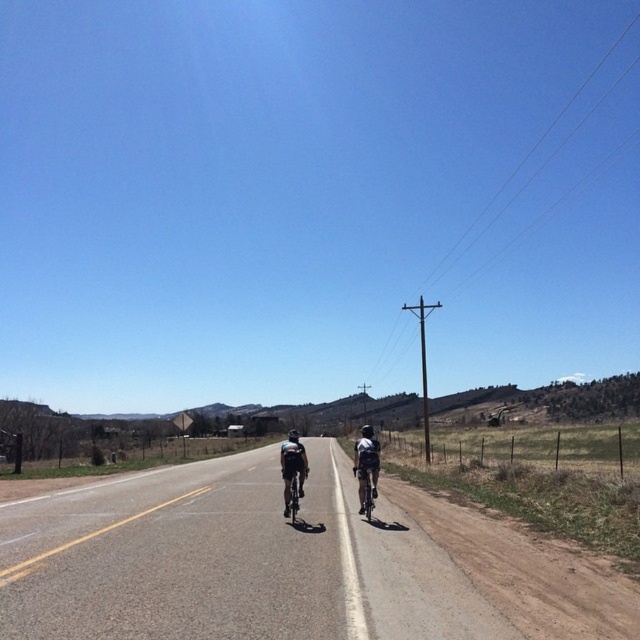
You are a delivery drone planning to fly over the rural road scene. The drone requires a minimum of 2 meters of clearance to safely pass between the asphalt road at center and the shiny metallic bicycle at center. Can you determine if there is enough space for the drone to pass safely?

The asphalt road at center might be wider than shiny metallic bicycle at center, but the exact width difference isn not specified. Without knowing the actual width of the road and the bicycle, it is impossible to determine if there is enough space for the drone to pass safely with 2 meters of clearance.

You are a cyclist planning to ride along the asphalt road at center. You have a shiny silver bicycle at center. Which object will occupy more space in your view as you ride forward?

The asphalt road at center will occupy more space in your view as you ride forward because it is larger in size than the shiny silver bicycle at center.

You are a photographer positioned at the camera location. You want to take a photo of two points on the road. The first point is at point (340,609) and the second point is at point (353,467). Which point will appear closer to the bottom edge of the photo?

Point (340,609) is closer to the camera than point (353,467). Therefore, point (340,609) will appear closer to the bottom edge of the photo.